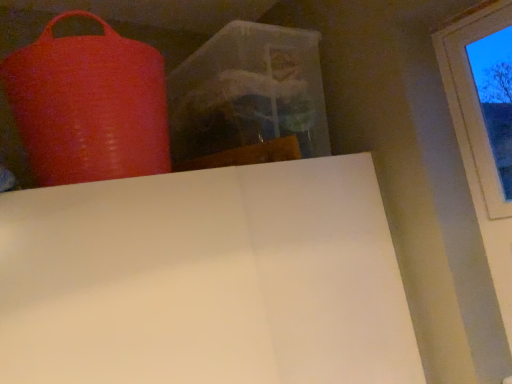
Question: From the image's perspective, is rubberized red punching bag at upper left positioned above or below transparent glass window at upper right?

Choices:
 (A) below
 (B) above

Answer: (B)

Question: From a real-world perspective, is rubberized red punching bag at upper left positioned above or below transparent glass window at upper right?

Choices:
 (A) below
 (B) above

Answer: (B)

Question: Considering their positions, is rubberized red punching bag at upper left located in front of or behind transparent glass window at upper right?

Choices:
 (A) behind
 (B) front

Answer: (B)

Question: From a real-world perspective, is transparent glass window at upper right physically located above or below rubberized red punching bag at upper left?

Choices:
 (A) above
 (B) below

Answer: (B)

Question: Is transparent glass window at upper right in front of or behind rubberized red punching bag at upper left in the image?

Choices:
 (A) behind
 (B) front

Answer: (A)

Question: Is transparent glass window at upper right inside or outside of rubberized red punching bag at upper left?

Choices:
 (A) inside
 (B) outside

Answer: (B)

Question: Considering the positions of transparent glass window at upper right and rubberized red punching bag at upper left in the image, is transparent glass window at upper right wider or thinner than rubberized red punching bag at upper left?

Choices:
 (A) thin
 (B) wide

Answer: (A)